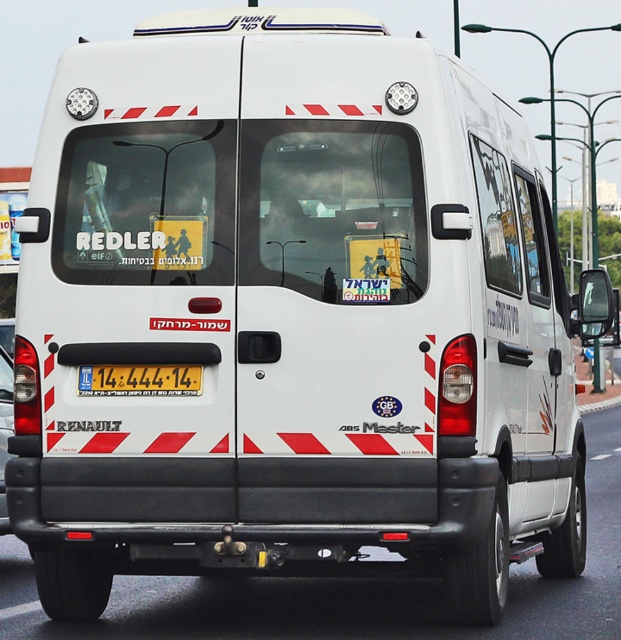
How distant is yellow plastic license plate at center from white matte van at center?

yellow plastic license plate at center is 9.48 feet away from white matte van at center.

Does point (196, 394) come in front of point (9, 369)?

That is True.

Identify the location of yellow plastic license plate at center. (138, 380).